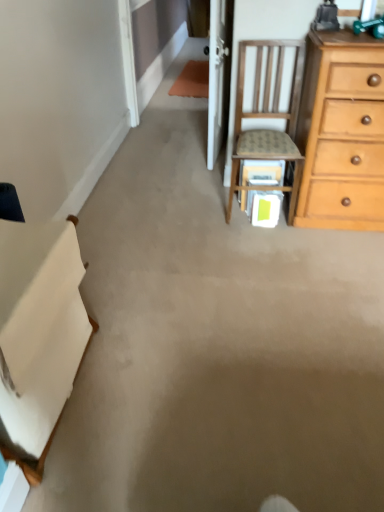
Where is `white fabric at left`? The height and width of the screenshot is (512, 384). white fabric at left is located at coordinates (29, 461).

What do you see at coordinates (29, 461) in the screenshot? This screenshot has width=384, height=512. I see `white fabric at left` at bounding box center [29, 461].

Measure the distance between point (237,99) and camera.

A distance of 2.60 meters exists between point (237,99) and camera.

In order to face wooden chair at upper right, should I rotate leftwards or rightwards?

To align with it, rotate right about 9.839°.

Measure the distance between wooden chair at upper right and camera.

The depth of wooden chair at upper right is 7.52 feet.

What do you see at coordinates (268, 116) in the screenshot? The image size is (384, 512). I see `wooden chair at upper right` at bounding box center [268, 116].

The width and height of the screenshot is (384, 512). What are the coordinates of `wooden chair at upper right` in the screenshot? It's located at (268, 116).

The height and width of the screenshot is (512, 384). I want to click on white fabric at left, so pos(29,461).

Consider the image. Considering the relative positions of white fabric at left and wooden chair at upper right in the image provided, is white fabric at left to the left of wooden chair at upper right from the viewer's perspective?

Correct, you'll find white fabric at left to the left of wooden chair at upper right.

Between white fabric at left and wooden chair at upper right, which one is positioned behind?

wooden chair at upper right is behind.

Does point (75, 378) come closer to viewer compared to point (247, 145)?

Yes.

Looking at this image, from the image's perspective, is white fabric at left above or below wooden chair at upper right?

white fabric at left is situated lower than wooden chair at upper right in the image.

From a real-world perspective, relative to wooden chair at upper right, is white fabric at left vertically above or below?

white fabric at left is below wooden chair at upper right.

Considering the sizes of objects white fabric at left and wooden chair at upper right in the image provided, who is thinner, white fabric at left or wooden chair at upper right?

white fabric at left.

From the picture: Between white fabric at left and wooden chair at upper right, which one has less height?

white fabric at left is shorter.

Is white fabric at left bigger than wooden chair at upper right?

Correct, white fabric at left is larger in size than wooden chair at upper right.

Is wooden chair at upper right located within white fabric at left?

No, wooden chair at upper right is located outside of white fabric at left.

Looking at this image, would you say white fabric at left is a long distance from wooden chair at upper right?

Absolutely, white fabric at left is distant from wooden chair at upper right.

Could you tell me if white fabric at left is turned towards wooden chair at upper right?

No, white fabric at left is not facing towards wooden chair at upper right.

In order to click on cabinetry on the left of wooden chair at upper right in this screenshot , I will do (x=29, y=461).

Considering the relative positions of wooden chair at upper right and white fabric at left in the image provided, is wooden chair at upper right to the left of white fabric at left from the viewer's perspective?

No.

Which object is closer to the camera, wooden chair at upper right or white fabric at left?

white fabric at left.

Which is closer, (295, 42) or (4, 455)?

The point (4, 455) is in front.

From the image's perspective, which one is positioned lower, wooden chair at upper right or white fabric at left?

white fabric at left, from the image's perspective.

From a real-world perspective, who is located higher, wooden chair at upper right or white fabric at left?

In real-world perspective, wooden chair at upper right is above.

Looking at their sizes, would you say wooden chair at upper right is wider or thinner than white fabric at left?

Clearly, wooden chair at upper right has more width compared to white fabric at left.

Is wooden chair at upper right shorter than white fabric at left?

No.

Is wooden chair at upper right bigger than white fabric at left?

No.

Is wooden chair at upper right located outside white fabric at left?

wooden chair at upper right is positioned outside white fabric at left.

Is there a large distance between wooden chair at upper right and white fabric at left?

Absolutely, wooden chair at upper right is distant from white fabric at left.

Does wooden chair at upper right turn towards white fabric at left?

No, wooden chair at upper right is not oriented towards white fabric at left.

How different are the orientations of wooden chair at upper right and white fabric at left in degrees?

89.6 degrees.

You are a GUI agent. You are given a task and a screenshot of the screen. Output one action in this format:
    pyautogui.click(x=<x>, y=<y>)
    Task: Click on the cabinetry below the wooden chair at upper right (from the image's perspective)
    The width and height of the screenshot is (384, 512).
    Given the screenshot: What is the action you would take?
    pos(29,461)

The image size is (384, 512). I want to click on chair that is above the white fabric at left (from the image's perspective), so click(268, 116).

Locate an element on the screen. cabinetry in front of the wooden chair at upper right is located at coordinates (29, 461).